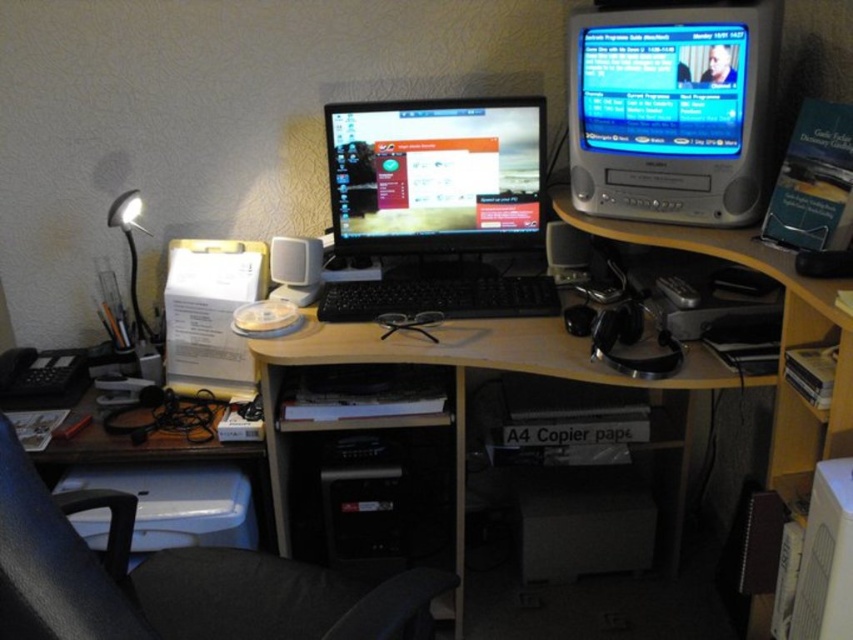
Question: Which point is closer to the camera?

Choices:
 (A) (341, 620)
 (B) (283, 257)

Answer: (A)

Question: Which of these objects is positioned closest to the matte plastic television at upper right?

Choices:
 (A) white plastic speaker at center
 (B) silver metallic television at upper right
 (C) black glossy monitor at center

Answer: (B)

Question: Can you confirm if black fabric swivel chair at lower left is positioned above matte silver lamp at left?

Choices:
 (A) yes
 (B) no

Answer: (B)

Question: Observing the image, what is the correct spatial positioning of wooden desk at center in reference to black fabric swivel chair at lower left?

Choices:
 (A) right
 (B) left

Answer: (A)

Question: Which point is farther to the camera?

Choices:
 (A) (137, 205)
 (B) (598, 10)
 (C) (613, 90)

Answer: (A)

Question: In this image, where is silver metallic television at upper right located relative to white plastic speaker at center?

Choices:
 (A) above
 (B) below

Answer: (A)